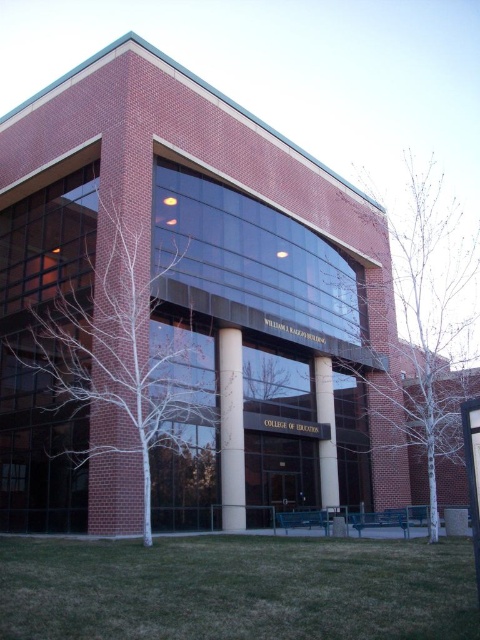
You are standing at the entrance of the William J. Raggio Building and want to take a photo of the point at coordinates point (269, 394). If your camera has a maximum focus range of 120 feet, will you be able to focus on that point?

The distance of point (269, 394) from the camera is 123.12 feet, which exceeds the camera maximum focus range of 120 feet. Therefore, the camera cannot focus on that point.

You are standing at the entrance of the William J. Raggio Building and notice a point marked at coordinates [104,342]. What object does this point correspond to?

The point at coordinates [104,342] corresponds to the white bark tree at center.

You are standing in front of the William J. Raggio Building and notice a white bark tree at center and a white marble pillar at center. Which object is positioned higher relative to the other?

The white bark tree at center is located above the white marble pillar at center, so the white bark tree at center is positioned higher.